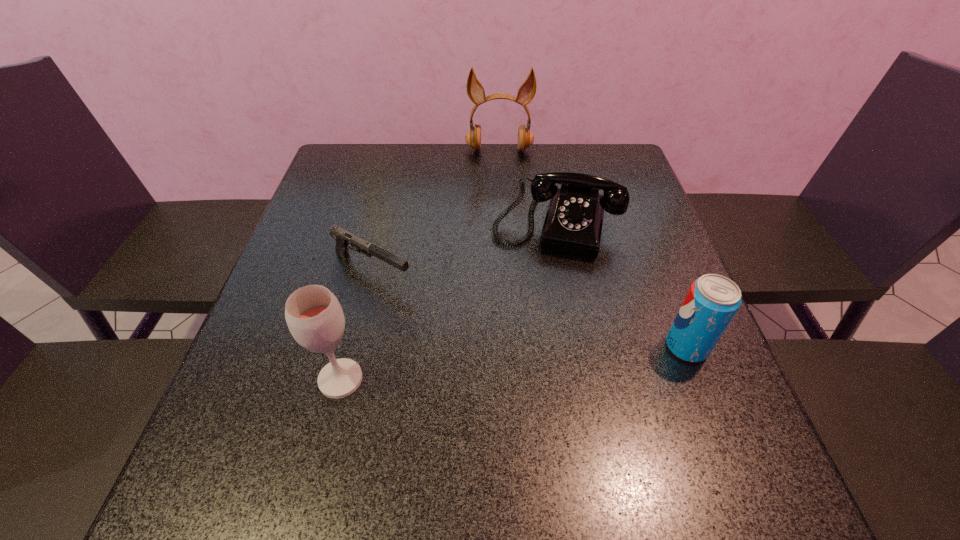
The height and width of the screenshot is (540, 960). I want to click on vacant space on the desktop that is between the wineglass and the soda can and is positioned on the front-facing side of the earphone, so click(503, 364).

At what (x,y) coordinates should I click in order to perform the action: click on vacant space on the desktop that is between the wineglass and the soda can and is positioned on the dial of the telephone. Please return your answer as a coordinate pair (x, y). The image size is (960, 540). Looking at the image, I should click on (521, 362).

The height and width of the screenshot is (540, 960). Find the location of `vacant space on the desktop that is between the wineglass and the soda can and is positioned at the muzzle end of the shortest object`. vacant space on the desktop that is between the wineglass and the soda can and is positioned at the muzzle end of the shortest object is located at coordinates (537, 361).